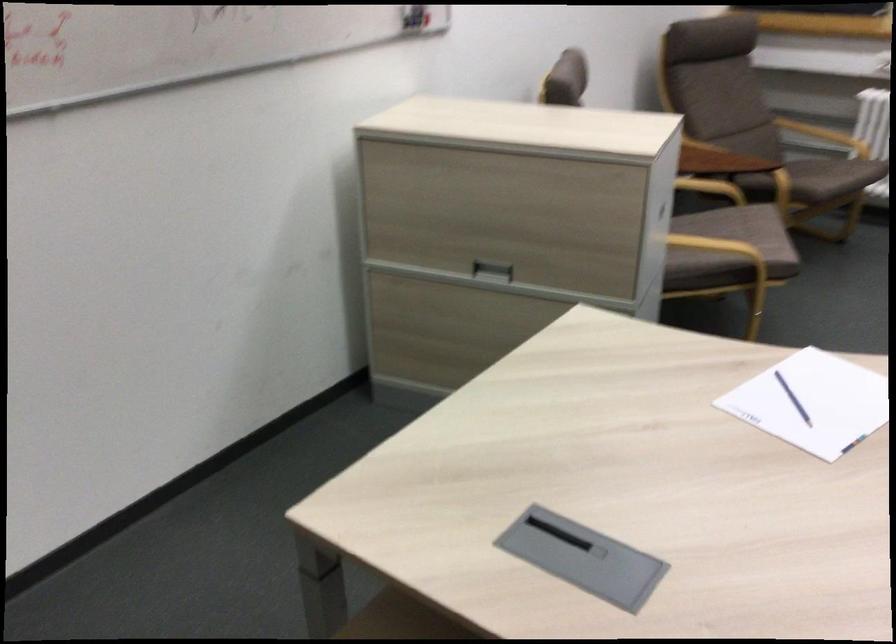
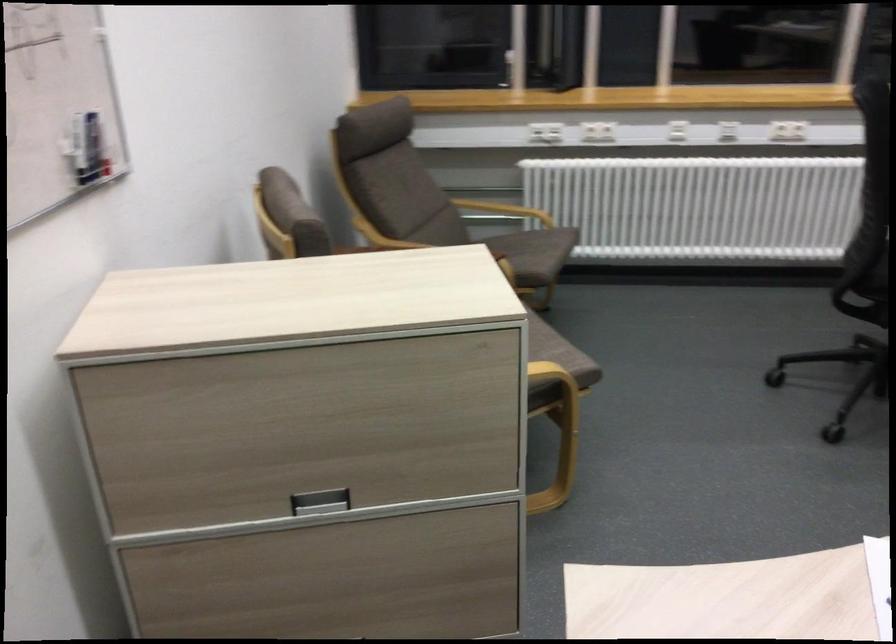
Question: The first image is from the beginning of the video and the second image is from the end. How did the camera likely rotate when shooting the video?

Choices:
 (A) Left
 (B) Right
 (C) Up
 (D) Down

Answer: (B)